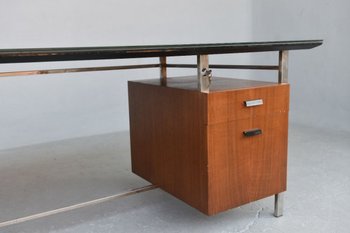
The height and width of the screenshot is (233, 350). What are the coordinates of `desk legs` in the screenshot? It's located at (282, 69), (163, 65).